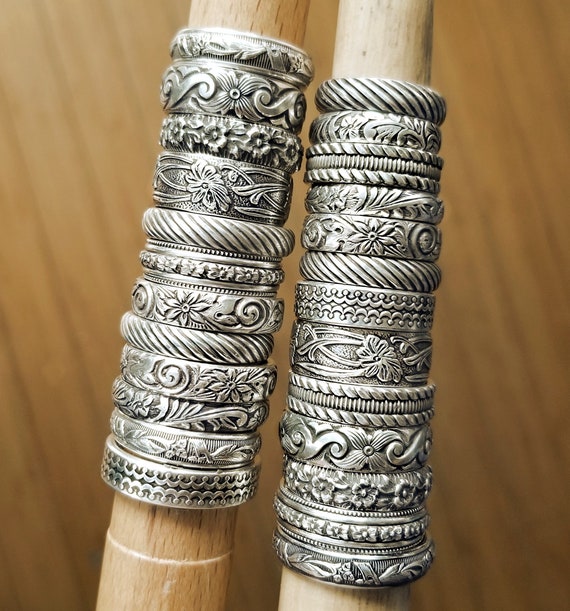
Image resolution: width=570 pixels, height=611 pixels. Find the location of `floor right side`. floor right side is located at coordinates (486, 425).